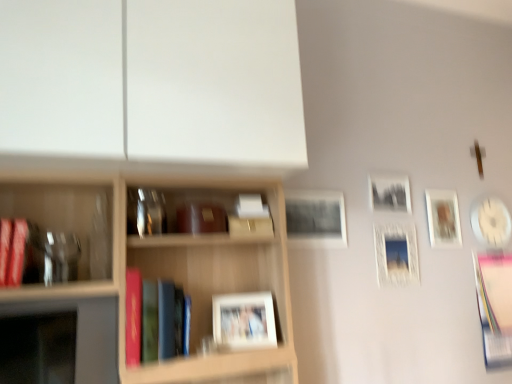
Question: Can you confirm if matte wooden picture frame at upper right, which is the 2th picture frame in back-to-front order, is wider than hardcover book at center, which ranks as the second book in left-to-right order?

Choices:
 (A) yes
 (B) no

Answer: (B)

Question: Does matte wooden picture frame at upper right, marked as the 5th picture frame in a front-to-back arrangement, have a greater height compared to hardcover book at center, marked as the 2th book in a back-to-front arrangement?

Choices:
 (A) yes
 (B) no

Answer: (B)

Question: Is matte wooden picture frame at upper right, marked as the 5th picture frame in a front-to-back arrangement, oriented towards hardcover book at center, which ranks as the 2th book in front-to-back order?

Choices:
 (A) no
 (B) yes

Answer: (A)

Question: From the image's perspective, would you say matte wooden picture frame at upper right, marked as the 5th picture frame in a front-to-back arrangement, is shown under hardcover book at center, marked as the 2th book in a back-to-front arrangement?

Choices:
 (A) no
 (B) yes

Answer: (A)

Question: Does matte wooden picture frame at upper right, marked as the 5th picture frame in a front-to-back arrangement, have a larger size compared to hardcover book at center, which is the 2th book in right-to-left order?

Choices:
 (A) no
 (B) yes

Answer: (A)

Question: Would you say white glossy picture frame at upper right, the 6th picture frame when ordered from front to back, is to the left or to the right of matte black picture frame at center, which is the fifth picture frame in back-to-front order, in the picture?

Choices:
 (A) left
 (B) right

Answer: (B)

Question: From a real-world perspective, is white glossy picture frame at upper right, the 6th picture frame when ordered from front to back, above or below matte black picture frame at center, the second picture frame from the left?

Choices:
 (A) below
 (B) above

Answer: (A)

Question: Which is correct: white glossy picture frame at upper right, the 6th picture frame when ordered from front to back, is inside matte black picture frame at center, the second picture frame from the left, or outside of it?

Choices:
 (A) outside
 (B) inside

Answer: (A)

Question: From the image's perspective, is white glossy picture frame at upper right, the first picture frame viewed from the right, positioned above or below matte black picture frame at center, which is the fifth picture frame in back-to-front order?

Choices:
 (A) above
 (B) below

Answer: (B)

Question: Is matte wooden picture frame at upper right, marked as the 2th picture frame in a right-to-left arrangement, to the left or to the right of matte black picture frame at center, which is the fifth picture frame in back-to-front order, in the image?

Choices:
 (A) left
 (B) right

Answer: (B)

Question: Is matte wooden picture frame at upper right, positioned as the 5th picture frame in left-to-right order, in front of or behind matte black picture frame at center, which is the fifth picture frame in back-to-front order, in the image?

Choices:
 (A) front
 (B) behind

Answer: (B)

Question: Considering the positions of matte wooden picture frame at upper right, marked as the 2th picture frame in a right-to-left arrangement, and matte black picture frame at center, the second picture frame from the left, in the image, is matte wooden picture frame at upper right, marked as the 2th picture frame in a right-to-left arrangement, bigger or smaller than matte black picture frame at center, the second picture frame from the left,?

Choices:
 (A) big
 (B) small

Answer: (B)

Question: Would you say matte wooden picture frame at upper right, positioned as the 5th picture frame in left-to-right order, is inside or outside matte black picture frame at center, which is the second picture frame from front to back?

Choices:
 (A) outside
 (B) inside

Answer: (A)

Question: Is point (26, 221) positioned closer to the camera than point (477, 230)?

Choices:
 (A) farther
 (B) closer

Answer: (B)

Question: Is matte red book at left, the third book viewed from the back, bigger or smaller than white glossy picture frame at upper right, positioned as the 1th picture frame in back-to-front order?

Choices:
 (A) small
 (B) big

Answer: (A)